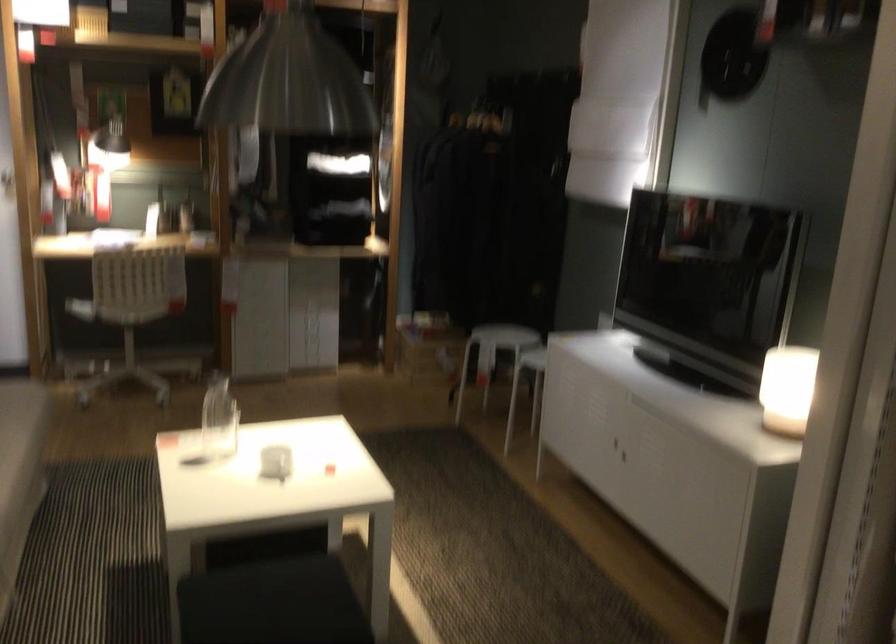
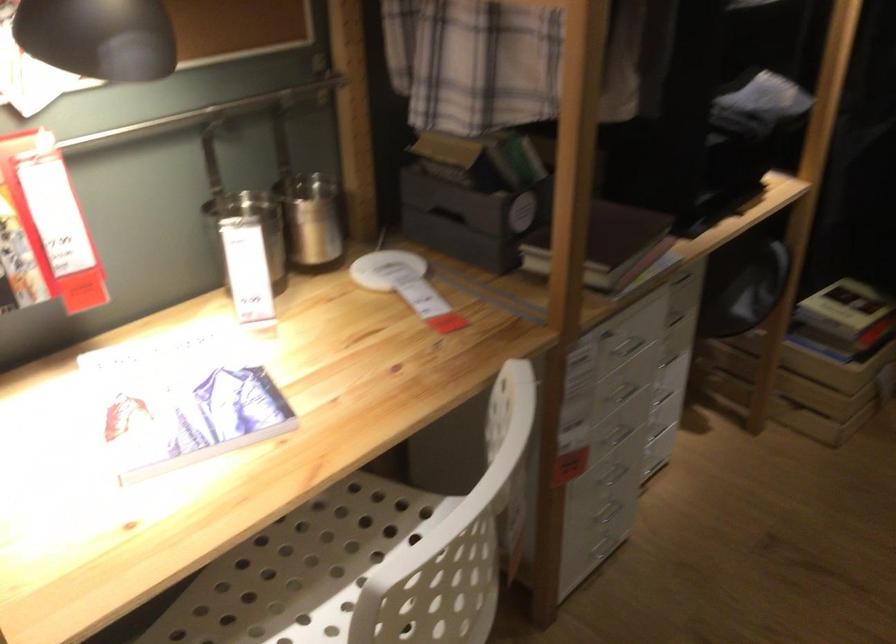
Which direction would the cameraman need to move to produce the second image?

The cameraman walked toward left, forward.